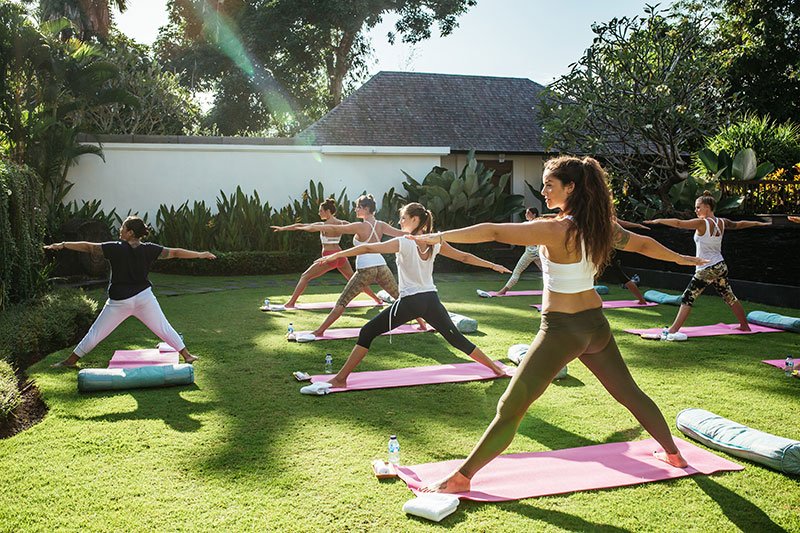
Locate an element on the screen. This screenshot has height=533, width=800. yoga mats is located at coordinates (546, 467), (410, 372), (706, 322), (624, 298), (518, 292), (345, 328), (320, 301), (142, 370).